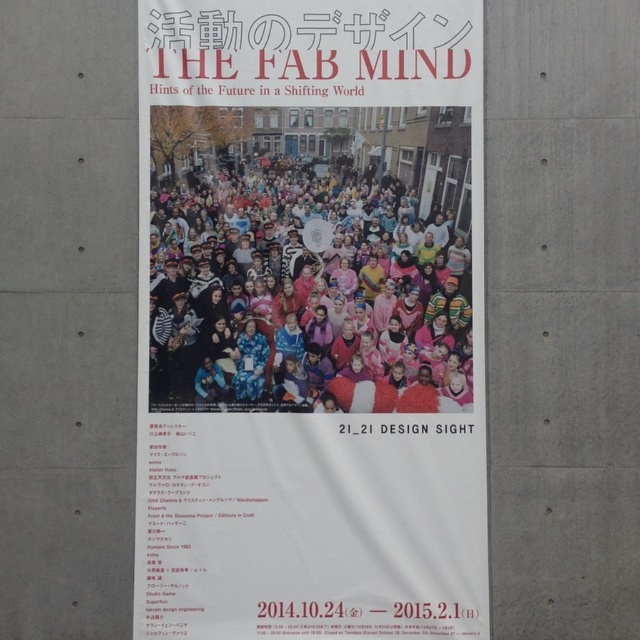
Please provide the 2D coordinates of the white paper poster at upper center in the image. Use the format of a point with two decimal places separated by a comma.

The 2D coordinates of the white paper poster at upper center are at point (x=310, y=321).

You are an event planner who wants to place a new decorative item on the wall where the white paper poster at upper center and the multicolored plush at center are displayed. Based on their current positions, where should you place the new item to ensure it is visible without being blocked by either object?

The white paper poster at upper center is in front of the multicolored plush at center, so placing the new item either above the white paper poster at upper center or below the multicolored plush at center would ensure visibility without obstruction.